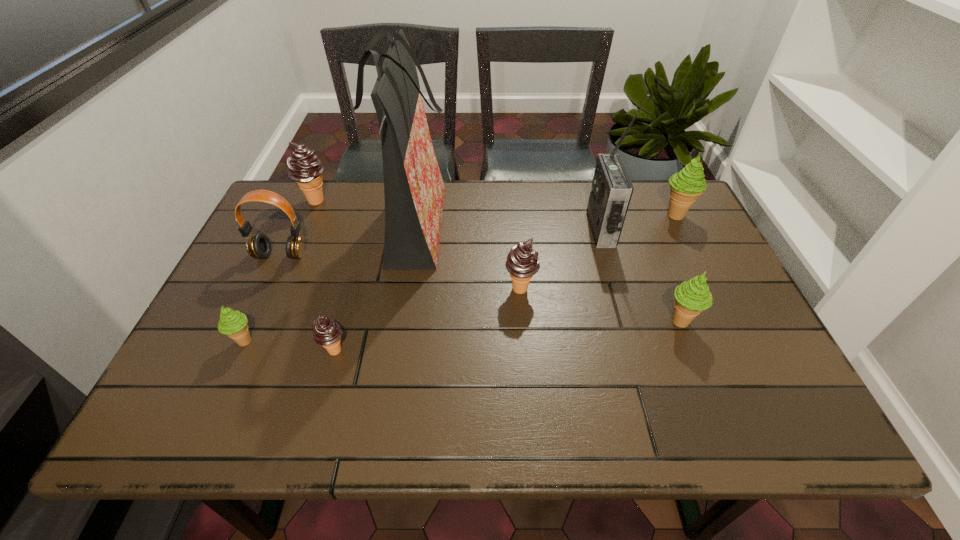
What are the coordinates of `the second biggest chocolate icecream` in the screenshot? It's located at (522, 263).

Where is `the eighth object from left to right`? Image resolution: width=960 pixels, height=540 pixels. the eighth object from left to right is located at coordinates (692, 297).

Identify the location of the second icecream from right to left. This screenshot has width=960, height=540. (692, 297).

At what (x,y) coordinates should I click in order to perform the action: click on the smallest green icecream. Please return your answer as a coordinate pair (x, y). The width and height of the screenshot is (960, 540). Looking at the image, I should click on (232, 323).

This screenshot has height=540, width=960. Find the location of `the smallest chocolate icecream`. the smallest chocolate icecream is located at coordinates (326, 332).

Find the location of a particular element. This screenshot has height=540, width=960. the fourth icecream from right to left is located at coordinates (326, 332).

The width and height of the screenshot is (960, 540). In order to click on vacant region located on the front side of the shopping bag in this screenshot , I will do `click(553, 230)`.

Identify the location of vacant space located 0.050m on the display of the seventh object from left to right. (573, 230).

The image size is (960, 540). Find the location of `vacant space situated 0.200m on the display of the seventh object from left to right`. vacant space situated 0.200m on the display of the seventh object from left to right is located at coordinates (521, 230).

What are the coordinates of `blank space located 0.150m on the display of the seventh object from left to right` in the screenshot? It's located at (539, 230).